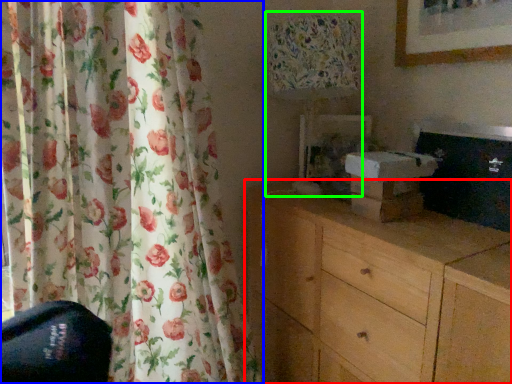
Question: Estimate the real-world distances between objects in this image. Which object is closer to chest of drawers (highlighted by a red box), curtain (highlighted by a blue box) or table lamp (highlighted by a green box)?

Choices:
 (A) curtain
 (B) table lamp

Answer: (B)